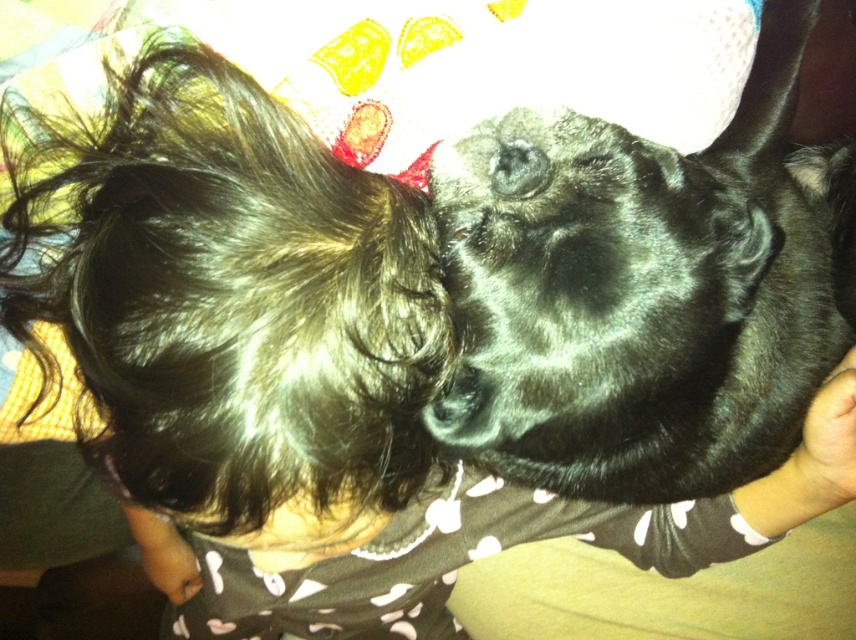
Is shiny dark brown hair at upper left above black fur nose at center?

Yes, shiny dark brown hair at upper left is above black fur nose at center.

Is shiny dark brown hair at upper left bigger than black fur nose at center?

Indeed, shiny dark brown hair at upper left has a larger size compared to black fur nose at center.

Who is more distant from viewer, (45, 211) or (470, 388)?

Point (45, 211)

Identify the location of shiny dark brown hair at upper left. This screenshot has height=640, width=856. tap(227, 296).

Is shiny dark brown hair at upper left below black fur dog at center?

Indeed, shiny dark brown hair at upper left is positioned under black fur dog at center.

Can you confirm if shiny dark brown hair at upper left is thinner than black fur dog at center?

Correct, shiny dark brown hair at upper left's width is less than black fur dog at center's.

Which is in front, point (387, 292) or point (614, 182)?

Point (387, 292) is in front.

Identify the location of shiny dark brown hair at upper left. (227, 296).

Does black fur dog at center have a lesser height compared to black fur nose at center?

Incorrect, black fur dog at center's height does not fall short of black fur nose at center's.

Between black fur dog at center and black fur nose at center, which one has more height?

black fur dog at center

Where is `black fur dog at center`? This screenshot has height=640, width=856. black fur dog at center is located at coordinates (649, 289).